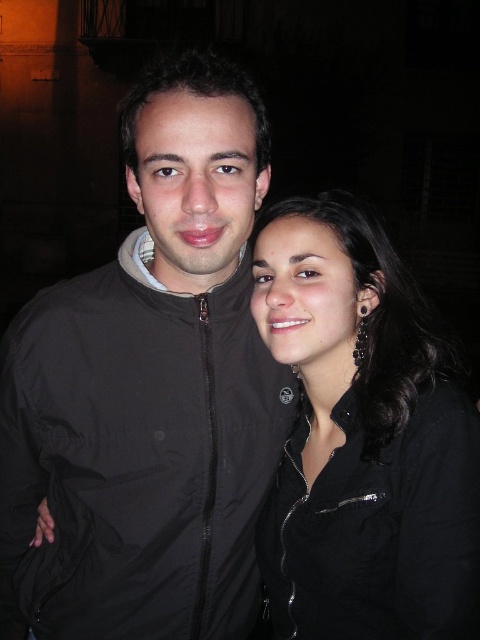
Question: Does black matte jacket at center appear on the left side of black matte shirt at right?

Choices:
 (A) no
 (B) yes

Answer: (B)

Question: Does black matte jacket at center have a greater width compared to black matte shirt at right?

Choices:
 (A) yes
 (B) no

Answer: (A)

Question: Does black matte jacket at center lie in front of black matte shirt at right?

Choices:
 (A) no
 (B) yes

Answer: (A)

Question: Which point is closer to the camera taking this photo?

Choices:
 (A) (201, 168)
 (B) (344, 449)

Answer: (A)